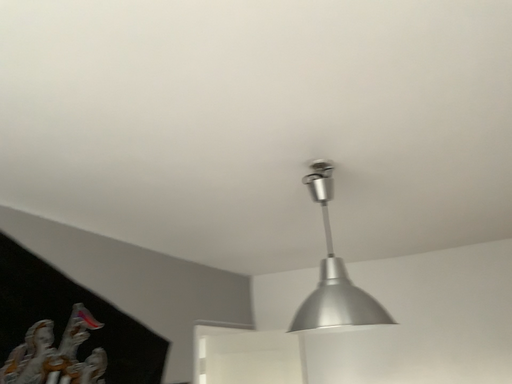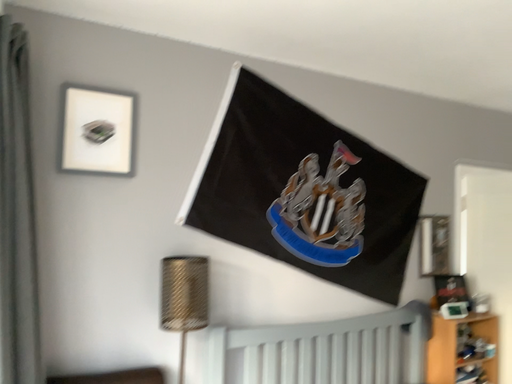
Question: How did the camera likely rotate when shooting the video?

Choices:
 (A) rotated downward
 (B) rotated upward

Answer: (A)